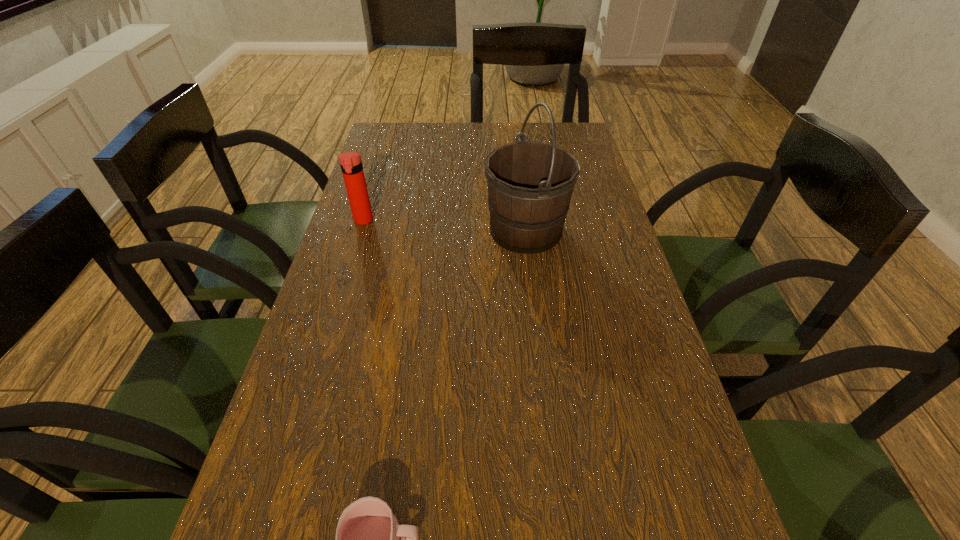
Locate an element on the screen. The image size is (960, 540). free space at the right edge of the desktop is located at coordinates 636,278.

Where is `free space at the far left corner`? free space at the far left corner is located at coordinates (378, 138).

I want to click on free space at the far right corner of the desktop, so click(582, 133).

The image size is (960, 540). Identify the location of free space between the second shortest object and the bucket. (444, 226).

The height and width of the screenshot is (540, 960). Find the location of `unoccupied area between the thermos bottle and the rightmost object`. unoccupied area between the thermos bottle and the rightmost object is located at coordinates (444, 226).

Locate an element on the screen. Image resolution: width=960 pixels, height=540 pixels. free space between the tallest object and the thermos bottle is located at coordinates (444, 226).

Identify which object is the second nearest to the nearest object. Please provide its 2D coordinates. Your answer should be formatted as a tuple, i.e. [(x, y)], where the tuple contains the x and y coordinates of a point satisfying the conditions above.

[(351, 165)]

At what (x,y) coordinates should I click in order to perform the action: click on object that is the second closest to the rightmost object. Please return your answer as a coordinate pair (x, y). Looking at the image, I should click on (370, 539).